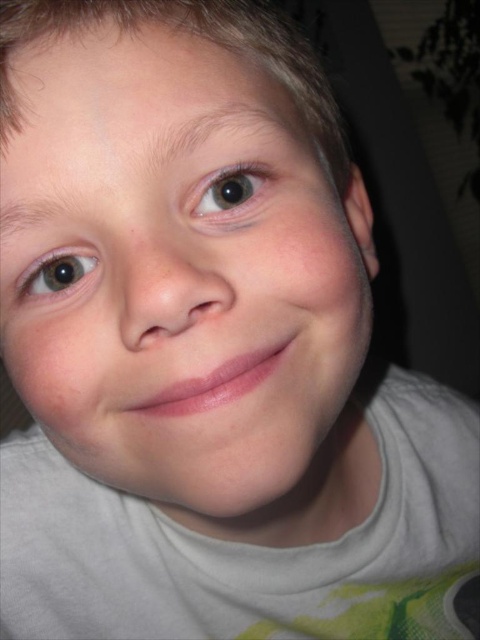
Can you confirm if brown glossy eye at upper left is positioned to the left of brown matte eye at left?

Incorrect, brown glossy eye at upper left is not on the left side of brown matte eye at left.

Who is positioned more to the left, brown glossy eye at upper left or brown matte eye at left?

From the viewer's perspective, brown matte eye at left appears more on the left side.

Does point (224, 184) lie behind point (36, 276)?

No, (224, 184) is in front of (36, 276).

Locate an element on the screen. The height and width of the screenshot is (640, 480). brown glossy eye at upper left is located at coordinates (230, 192).

Does smooth skin face at center have a smaller size compared to brown matte eye at left?

Actually, smooth skin face at center might be larger than brown matte eye at left.

Does smooth skin face at center appear on the right side of brown matte eye at left?

Indeed, smooth skin face at center is positioned on the right side of brown matte eye at left.

Identify the location of smooth skin face at center. Image resolution: width=480 pixels, height=640 pixels. (180, 273).

Can you confirm if smooth skin face at center is shorter than brown glossy eye at upper left?

In fact, smooth skin face at center may be taller than brown glossy eye at upper left.

Between smooth skin face at center and brown glossy eye at upper left, which one appears on the left side from the viewer's perspective?

From the viewer's perspective, brown glossy eye at upper left appears more on the left side.

The image size is (480, 640). I want to click on smooth skin face at center, so click(180, 273).

I want to click on smooth skin face at center, so click(180, 273).